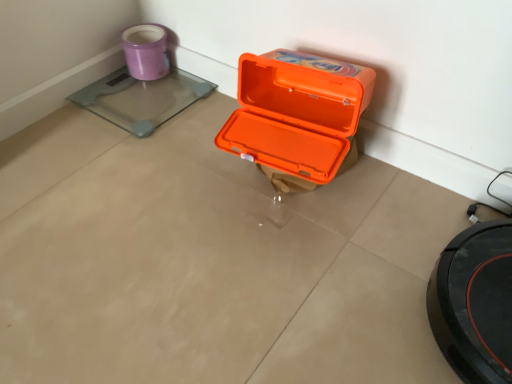
Question: Would you say orange plastic box at center is to the left or to the right of transparent glass scale at upper left in the picture?

Choices:
 (A) left
 (B) right

Answer: (B)

Question: In terms of size, does orange plastic box at center appear bigger or smaller than transparent glass scale at upper left?

Choices:
 (A) big
 (B) small

Answer: (A)

Question: Which object is positioned farthest from the orange plastic box at center?

Choices:
 (A) matte purple mug at upper left
 (B) transparent glass scale at upper left

Answer: (A)

Question: Estimate the real-world distances between objects in this image. Which object is closer to the transparent glass scale at upper left?

Choices:
 (A) matte purple mug at upper left
 (B) orange plastic box at center

Answer: (A)